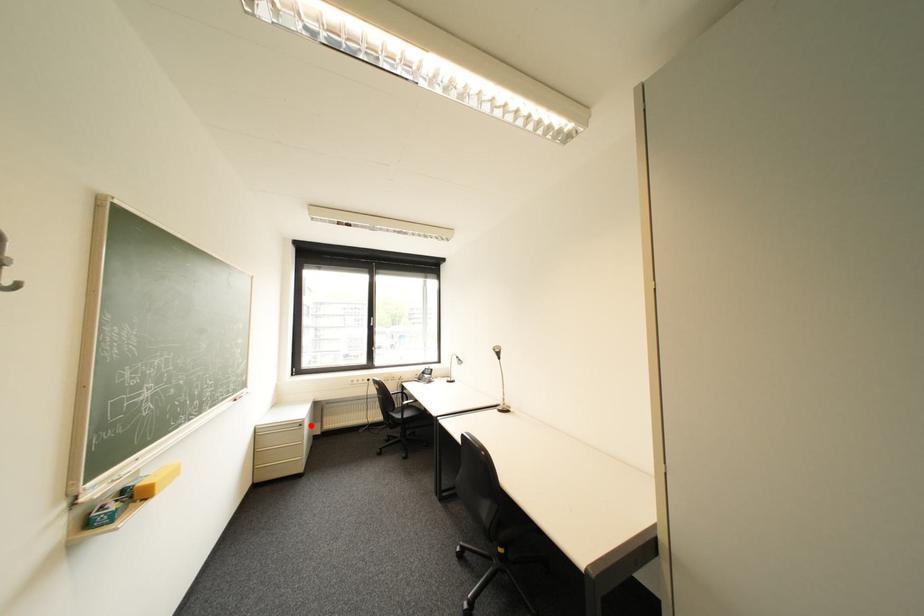
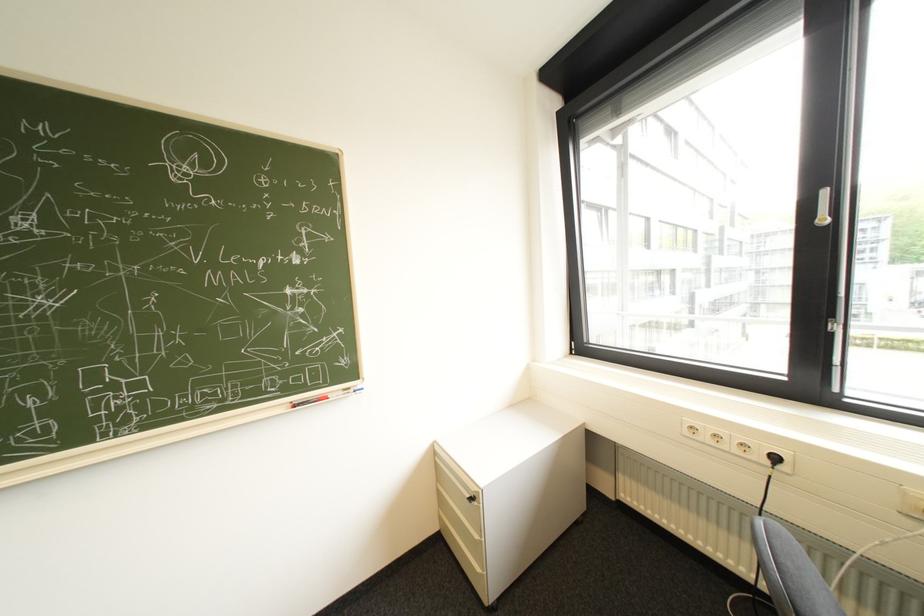
Find the pixel in the second image that matches the highlighted location in the first image.

(482, 499)